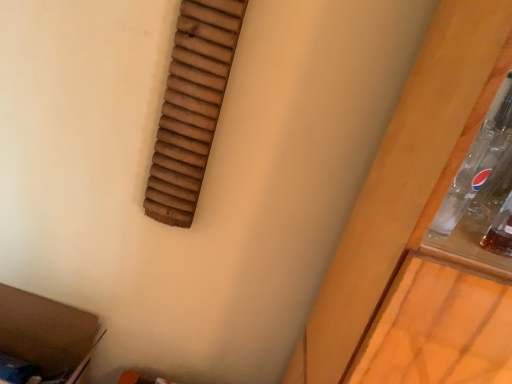
Question: Is brown cardboard at lower left next to wooden slats at upper left?

Choices:
 (A) yes
 (B) no

Answer: (B)

Question: Is brown cardboard at lower left facing away from wooden slats at upper left?

Choices:
 (A) yes
 (B) no

Answer: (B)

Question: Could you tell me if brown cardboard at lower left is facing wooden slats at upper left?

Choices:
 (A) yes
 (B) no

Answer: (B)

Question: From the image's perspective, is brown cardboard at lower left on wooden slats at upper left?

Choices:
 (A) no
 (B) yes

Answer: (A)

Question: Is brown cardboard at lower left positioned beyond the bounds of wooden slats at upper left?

Choices:
 (A) no
 (B) yes

Answer: (B)

Question: Does brown cardboard at lower left have a lesser height compared to wooden slats at upper left?

Choices:
 (A) no
 (B) yes

Answer: (B)

Question: Can you confirm if wooden slats at upper left is shorter than brown cardboard at lower left?

Choices:
 (A) no
 (B) yes

Answer: (A)

Question: From a real-world perspective, does wooden slats at upper left sit lower than brown cardboard at lower left?

Choices:
 (A) no
 (B) yes

Answer: (A)

Question: Does wooden slats at upper left appear on the right side of brown cardboard at lower left?

Choices:
 (A) yes
 (B) no

Answer: (A)

Question: Is wooden slats at upper left bigger than brown cardboard at lower left?

Choices:
 (A) no
 (B) yes

Answer: (A)

Question: Is wooden slats at upper left next to brown cardboard at lower left and touching it?

Choices:
 (A) no
 (B) yes

Answer: (A)

Question: From the image's perspective, is wooden slats at upper left above brown cardboard at lower left?

Choices:
 (A) no
 (B) yes

Answer: (B)

Question: Is brown cardboard at lower left inside the boundaries of wooden slats at upper left, or outside?

Choices:
 (A) inside
 (B) outside

Answer: (B)